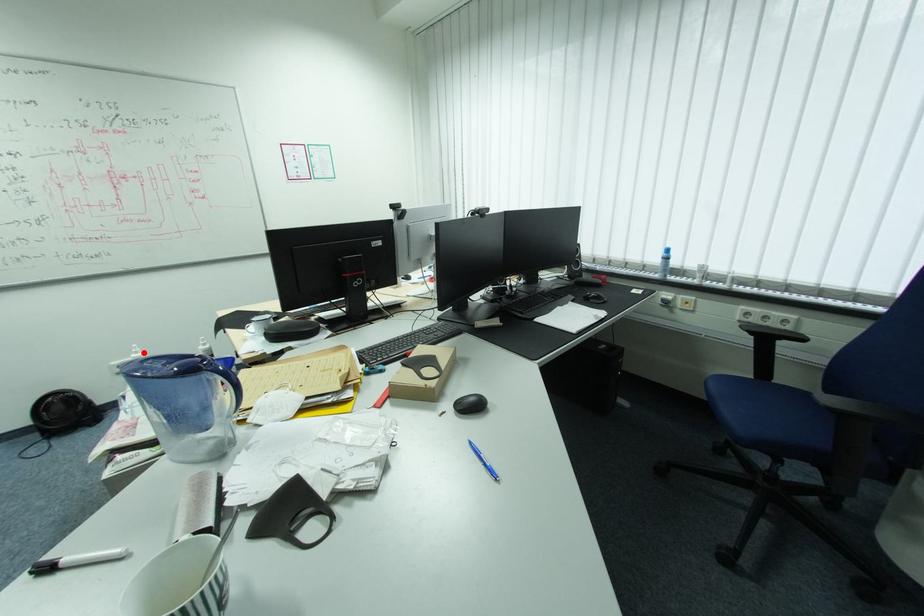
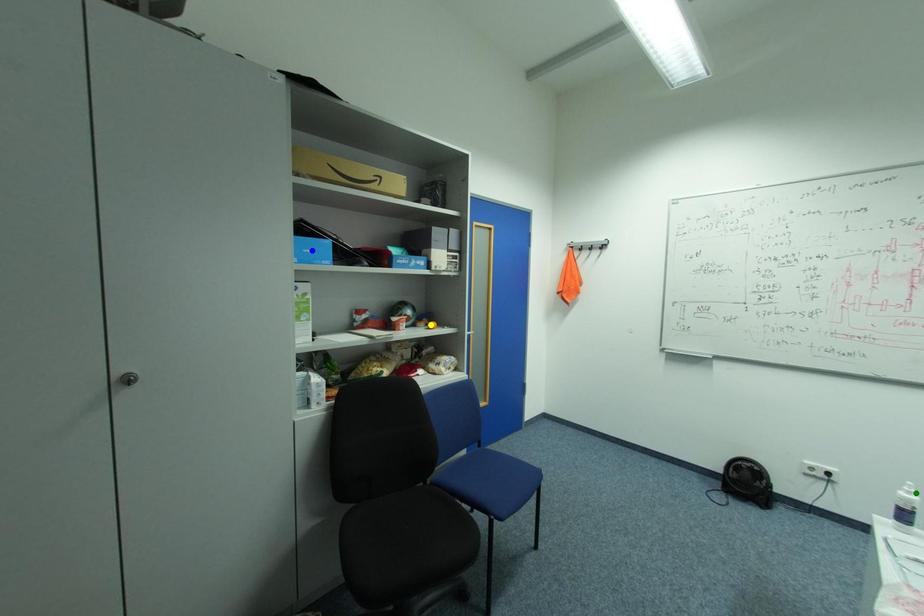
Question: I am providing you with two images of the same scene from different viewpoints. A red point is marked on the first image. You are given multiple points on the second image. Can you choose the point in image 2 that corresponds to the point in image 1?

Choices:
 (A) blue point
 (B) green point
 (C) yellow point

Answer: (B)